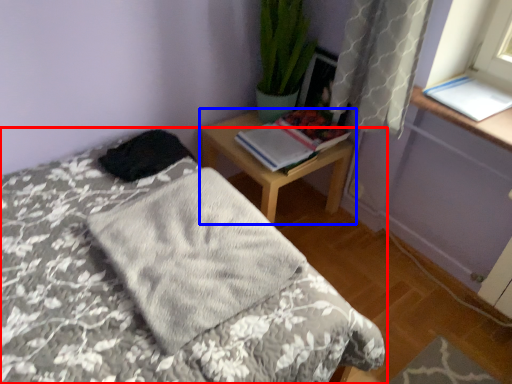
Question: Which object appears farthest to the camera in this image, bed (highlighted by a red box) or nightstand (highlighted by a blue box)?

Choices:
 (A) bed
 (B) nightstand

Answer: (B)